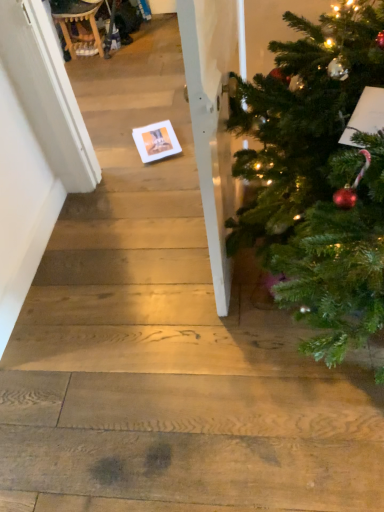
Locate an element on the screen. Image resolution: width=384 pixels, height=512 pixels. free space in front of white matte card at center is located at coordinates (157, 164).